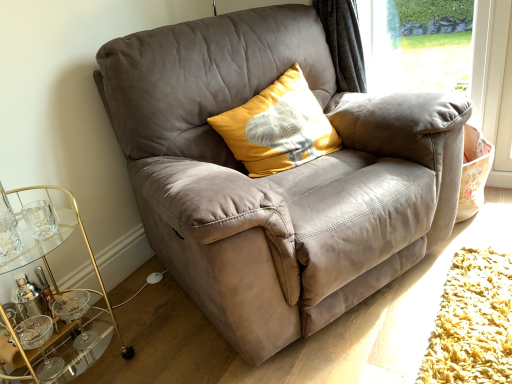
What is the approximate width of gold glass cocktail table at lower left?

The width of gold glass cocktail table at lower left is 14.17 inches.

Where is `gold glass cocktail table at lower left`? Image resolution: width=512 pixels, height=384 pixels. gold glass cocktail table at lower left is located at coordinates (49, 286).

Where is `transparent glass window screen at upper right`? transparent glass window screen at upper right is located at coordinates (416, 44).

Is yellow textured cushion at center smaller than transparent glass window screen at upper right?

No, yellow textured cushion at center is not smaller than transparent glass window screen at upper right.

From the image's perspective, is yellow textured cushion at center above or below transparent glass window screen at upper right?

From the image's perspective, yellow textured cushion at center appears below transparent glass window screen at upper right.

At what (x,y) coordinates should I click in order to perform the action: click on window screen behind the yellow textured cushion at center. Please return your answer as a coordinate pair (x, y). The height and width of the screenshot is (384, 512). Looking at the image, I should click on (416, 44).

Is yellow textured cushion at center beside transparent glass window screen at upper right?

No, yellow textured cushion at center is not in contact with transparent glass window screen at upper right.

Does gold glass cocktail table at lower left have a larger size compared to suede gray chair at center?

Incorrect, gold glass cocktail table at lower left is not larger than suede gray chair at center.

Is gold glass cocktail table at lower left at the left side of suede gray chair at center?

Yes, gold glass cocktail table at lower left is to the left of suede gray chair at center.

How different are the orientations of gold glass cocktail table at lower left and suede gray chair at center in degrees?

24.4 degrees.

Is gold glass cocktail table at lower left oriented away from suede gray chair at center?

gold glass cocktail table at lower left does not have its back to suede gray chair at center.

In the scene shown: From the image's perspective, is suede gray chair at center under gold glass cocktail table at lower left?

No.

Does suede gray chair at center have a greater height compared to gold glass cocktail table at lower left?

Yes.

Is suede gray chair at center not within gold glass cocktail table at lower left?

Yes, suede gray chair at center is outside of gold glass cocktail table at lower left.

Considering the positions of objects suede gray chair at center and gold glass cocktail table at lower left in the image provided, who is more to the right, suede gray chair at center or gold glass cocktail table at lower left?

Positioned to the right is suede gray chair at center.

Between transparent glass window screen at upper right and suede gray chair at center, which one has less height?

transparent glass window screen at upper right.

Is transparent glass window screen at upper right not within suede gray chair at center?

transparent glass window screen at upper right lies outside suede gray chair at center's area.

Between transparent glass window screen at upper right and suede gray chair at center, which one has smaller size?

With smaller size is transparent glass window screen at upper right.

Looking at this image, which object is positioned more to the right, yellow textured cushion at center or suede gray chair at center?

From the viewer's perspective, suede gray chair at center appears more on the right side.

Looking at this image, relative to suede gray chair at center, is yellow textured cushion at center in front or behind?

yellow textured cushion at center is behind suede gray chair at center.

Considering the sizes of yellow textured cushion at center and suede gray chair at center in the image, is yellow textured cushion at center wider or thinner than suede gray chair at center?

yellow textured cushion at center is thinner than suede gray chair at center.

Between yellow textured cushion at center and suede gray chair at center, which one has less height?

With less height is yellow textured cushion at center.

Is gold glass cocktail table at lower left inside transparent glass window screen at upper right?

No, gold glass cocktail table at lower left is not a part of transparent glass window screen at upper right.

What are the coordinates of `cocktail table on the left of transparent glass window screen at upper right` in the screenshot? It's located at pos(49,286).

Looking at this image, is transparent glass window screen at upper right facing away from gold glass cocktail table at lower left?

No, transparent glass window screen at upper right is not facing the opposite direction of gold glass cocktail table at lower left.

How much distance is there between gold glass cocktail table at lower left and yellow textured cushion at center?

gold glass cocktail table at lower left is 31.31 inches from yellow textured cushion at center.

This screenshot has width=512, height=384. What are the coordinates of `cocktail table that appears on the left of yellow textured cushion at center` in the screenshot? It's located at (49, 286).

Does gold glass cocktail table at lower left have a smaller size compared to yellow textured cushion at center?

No, gold glass cocktail table at lower left is not smaller than yellow textured cushion at center.

Does gold glass cocktail table at lower left appear on the left side of yellow textured cushion at center?

Indeed, gold glass cocktail table at lower left is positioned on the left side of yellow textured cushion at center.

Identify the location of pillow above the transparent glass window screen at upper right (from a real-world perspective). (278, 127).

The image size is (512, 384). In order to click on cocktail table below the suede gray chair at center (from a real-world perspective) in this screenshot , I will do `click(49, 286)`.

When comparing their distances from transparent glass window screen at upper right, does suede gray chair at center or yellow textured cushion at center seem closer?

Based on the image, yellow textured cushion at center appears to be nearer to transparent glass window screen at upper right.

Considering their positions, is yellow textured cushion at center positioned closer to gold glass cocktail table at lower left than suede gray chair at center?

The object closer to gold glass cocktail table at lower left is suede gray chair at center.

From the picture: Which object lies nearer to the anchor point suede gray chair at center, yellow textured cushion at center or gold glass cocktail table at lower left?

yellow textured cushion at center lies closer to suede gray chair at center than the other object.

From the image, which object appears to be nearer to yellow textured cushion at center, transparent glass window screen at upper right or gold glass cocktail table at lower left?

transparent glass window screen at upper right is positioned closer to the anchor yellow textured cushion at center.

Based on their spatial positions, is suede gray chair at center or transparent glass window screen at upper right closer to gold glass cocktail table at lower left?

The object closer to gold glass cocktail table at lower left is suede gray chair at center.

Based on their spatial positions, is suede gray chair at center or gold glass cocktail table at lower left further from transparent glass window screen at upper right?

Based on the image, gold glass cocktail table at lower left appears to be further to transparent glass window screen at upper right.

From the image, which object appears to be nearer to transparent glass window screen at upper right, gold glass cocktail table at lower left or suede gray chair at center?

suede gray chair at center.

From the image, which object appears to be farther from suede gray chair at center, gold glass cocktail table at lower left or transparent glass window screen at upper right?

Based on the image, transparent glass window screen at upper right appears to be further to suede gray chair at center.

You are a GUI agent. You are given a task and a screenshot of the screen. Output one action in this format:
    pyautogui.click(x=<x>, y=<y>)
    Task: Click on the chair between gold glass cocktail table at lower left and transparent glass window screen at upper right
    
    Given the screenshot: What is the action you would take?
    pyautogui.click(x=276, y=175)

Locate an element on the screen. Image resolution: width=512 pixels, height=384 pixels. pillow between gold glass cocktail table at lower left and transparent glass window screen at upper right is located at coordinates (278, 127).

The image size is (512, 384). Identify the location of pillow located between suede gray chair at center and transparent glass window screen at upper right in the depth direction. point(278,127).

This screenshot has height=384, width=512. Identify the location of pillow located between gold glass cocktail table at lower left and suede gray chair at center in the left-right direction. (278, 127).